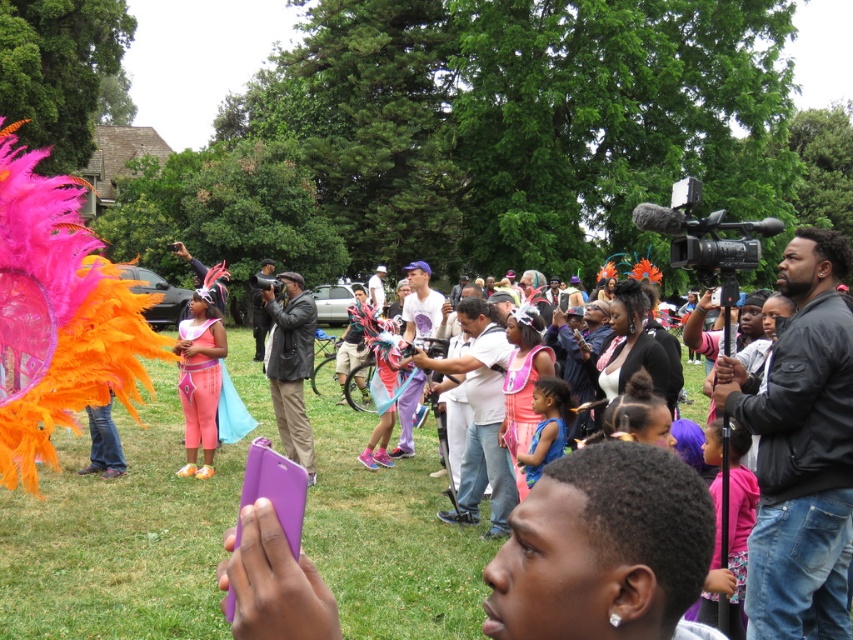
Question: Which point appears closest to the camera in this image?

Choices:
 (A) (372, 291)
 (B) (457, 356)
 (C) (305, 449)

Answer: (B)

Question: Does purple cotton shirt at center have a larger size compared to light brown leather jacket at center?

Choices:
 (A) yes
 (B) no

Answer: (B)

Question: Is leather jacket at center thinner than blue matte dress at center?

Choices:
 (A) no
 (B) yes

Answer: (A)

Question: Which object is farther from the camera taking this photo?

Choices:
 (A) purple cotton shirt at center
 (B) light brown leather jacket at center
 (C) pink fabric dress at center

Answer: (B)

Question: Which object is positioned closest to the leather jacket at center?

Choices:
 (A) light brown leather jacket at center
 (B) purple cotton shirt at center

Answer: (B)

Question: Is leather jacket at center to the left of purple cotton shirt at center from the viewer's perspective?

Choices:
 (A) no
 (B) yes

Answer: (B)